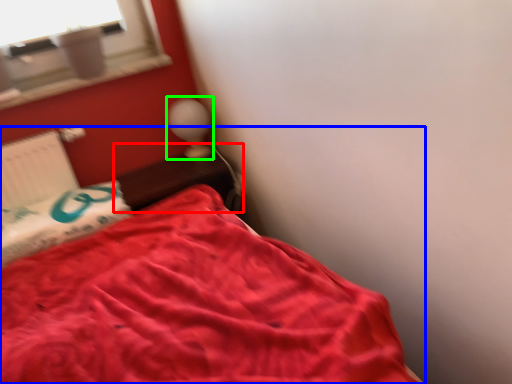
Question: Considering the real-world distances, which object is closest to table (highlighted by a red box)? bed (highlighted by a blue box) or table lamp (highlighted by a green box).

Choices:
 (A) bed
 (B) table lamp

Answer: (B)